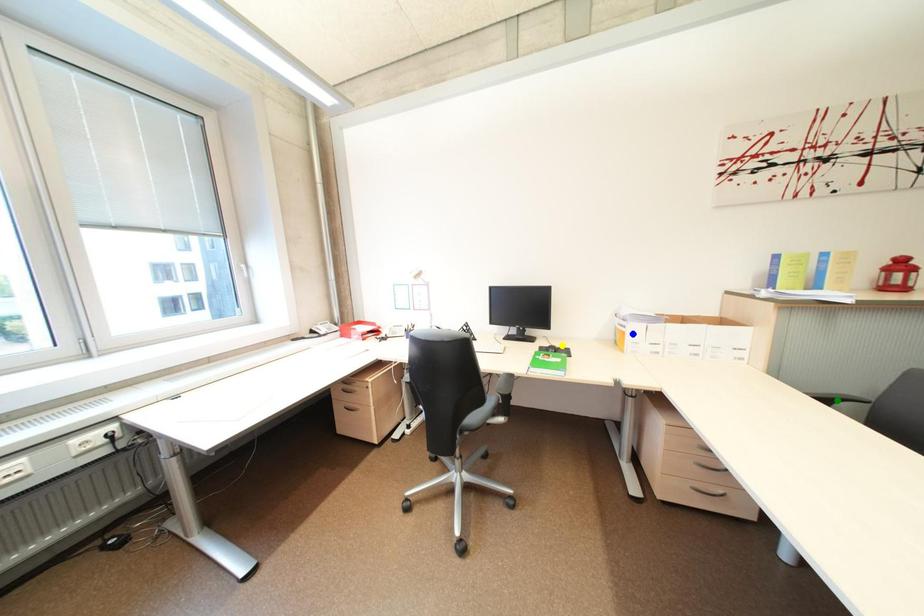
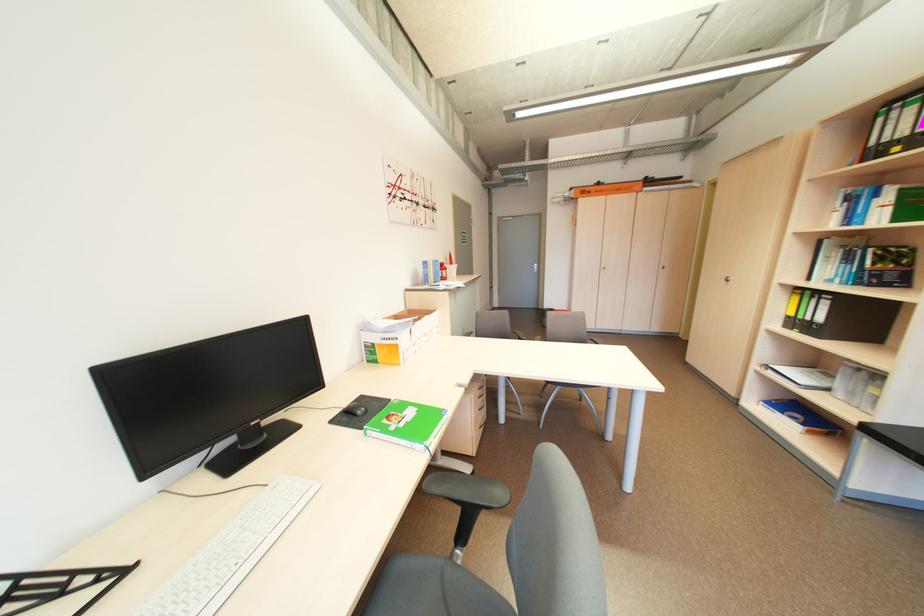
I am providing you with two images of the same scene from different viewpoints. Three points are marked in image1. Which point corresponds to a part or object that is occluded in image2?In image1, three points are marked. Which of them correspond to a part or object that is occluded in image2?Among the three points shown in image1, which one corresponds to a part or object that is no longer visible due to occlusion in image2?

green point